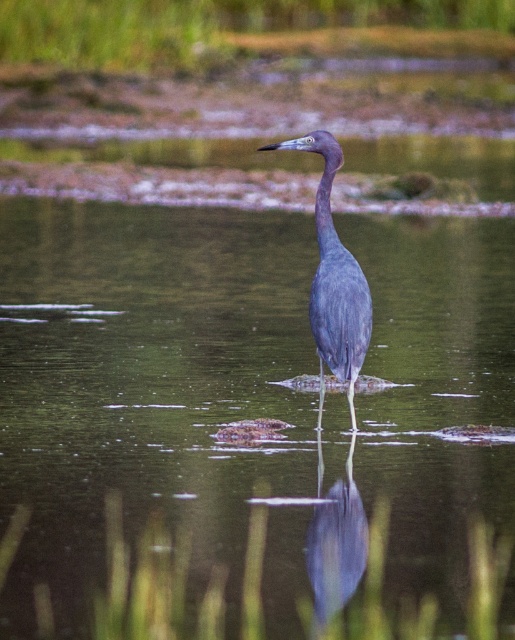
Question: Can you confirm if clear water at center is positioned above smooth gray heron at center?

Choices:
 (A) yes
 (B) no

Answer: (A)

Question: Which point is farther to the camera?

Choices:
 (A) clear water at center
 (B) smooth gray heron at center

Answer: (A)

Question: Based on their relative distances, which object is farther from the satin blue heron at center?

Choices:
 (A) clear water at center
 (B) smooth gray heron at center

Answer: (A)

Question: Can you confirm if clear water at center is bigger than satin blue heron at center?

Choices:
 (A) no
 (B) yes

Answer: (B)

Question: Is clear water at center to the right of smooth gray heron at center from the viewer's perspective?

Choices:
 (A) yes
 (B) no

Answer: (B)

Question: Based on their relative distances, which object is farther from the clear water at center?

Choices:
 (A) smooth gray heron at center
 (B) satin blue heron at center

Answer: (A)